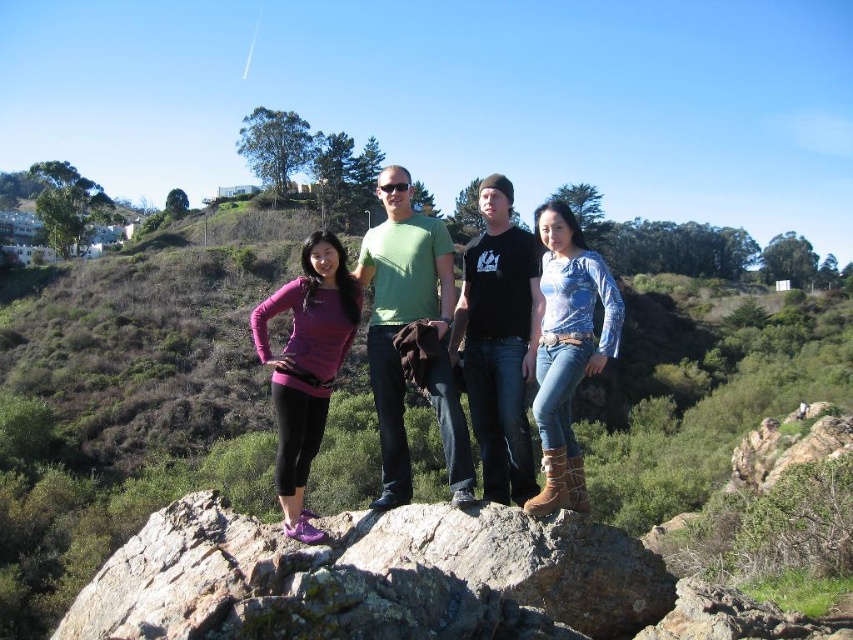
Question: Among these points, which one is farthest from the camera?

Choices:
 (A) (682, 445)
 (B) (368, 355)

Answer: (A)

Question: Which object is the closest to the green grassy hillside at center?

Choices:
 (A) black cotton t-shirt at center
 (B) green matte t-shirt at center
 (C) matte green t-shirt at center
 (D) blue denim jeans at center

Answer: (C)

Question: Can you confirm if green matte t-shirt at center is bigger than blue denim jeans at center?

Choices:
 (A) yes
 (B) no

Answer: (A)

Question: Which of the following is the farthest from the observer?

Choices:
 (A) (308, 310)
 (B) (590, 262)
 (C) (532, 301)
 (D) (399, 269)

Answer: (D)

Question: Can you confirm if green grassy hillside at center is positioned to the right of matte green t-shirt at center?

Choices:
 (A) no
 (B) yes

Answer: (B)

Question: Does black cotton t-shirt at center have a greater width compared to blue denim jeans at center?

Choices:
 (A) no
 (B) yes

Answer: (B)